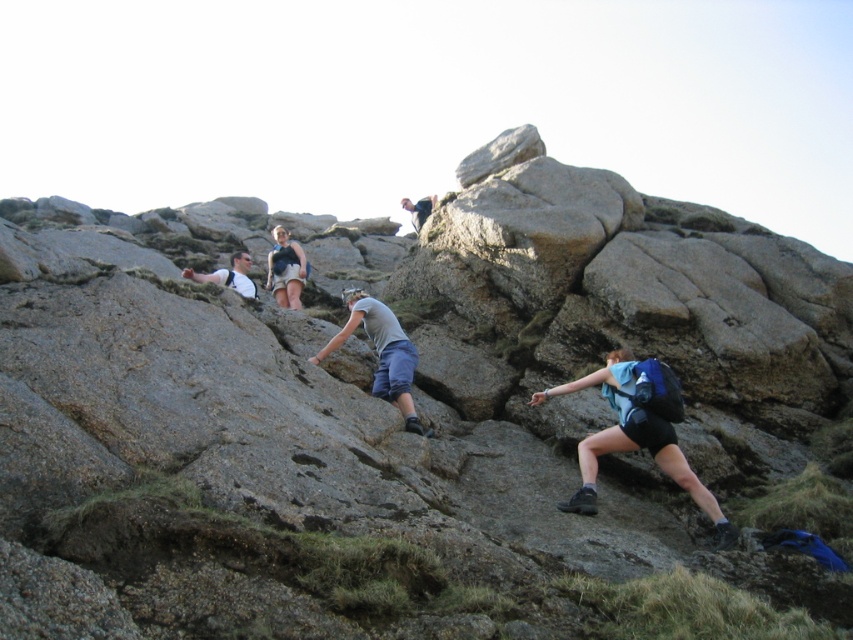
You are a hiker who wants to place your blue fabric backpack at lower right and matte gray shirt at lower left on a flat rock surface. Which object should you place first to ensure both fit without overlapping?

The blue fabric backpack at lower right is taller than matte gray shirt at lower left. Therefore, you should place the taller backpack first to ensure there is enough space for both items without overlapping.

You are a photographer trying to capture a photo of the gray fabric pants at center and the matte gray shirt at lower left. Which object should you focus on first if you want to include both in the frame without moving the camera?

The gray fabric pants at center has a greater height compared to the matte gray shirt at lower left, so you should focus on the gray fabric pants at center first to ensure both are in frame.

You are a hiker planning to carry both the blue fabric backpack at lower right and the gray fabric pants at center. Based on their sizes, which item can hold more items?

The blue fabric backpack at lower right has a larger width than the gray fabric pants at center, so it can hold more items.